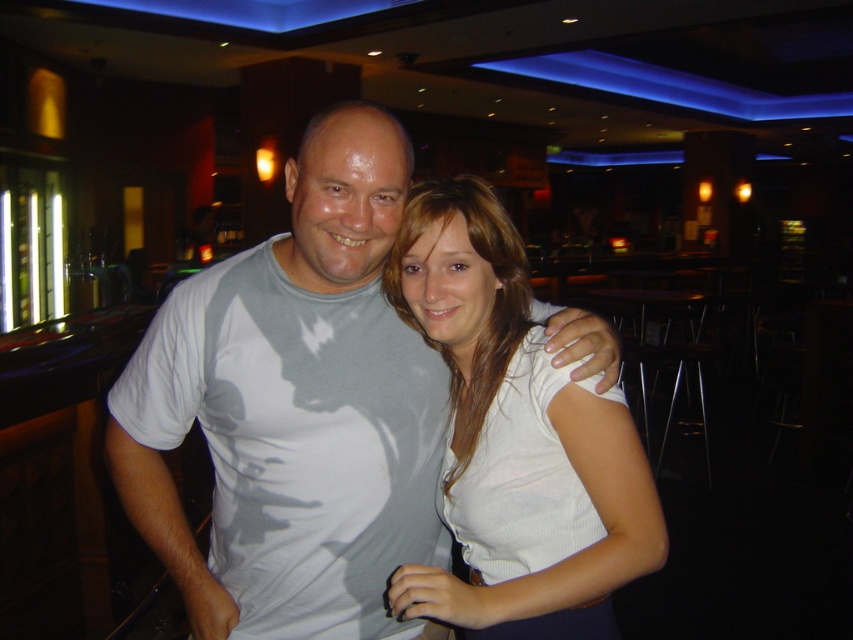
Between white matte t-shirt at center and white ribbed shirt at center, which one appears on the right side from the viewer's perspective?

From the viewer's perspective, white ribbed shirt at center appears more on the right side.

The width and height of the screenshot is (853, 640). Describe the element at coordinates (294, 408) in the screenshot. I see `white matte t-shirt at center` at that location.

Find the location of a particular element. The height and width of the screenshot is (640, 853). white matte t-shirt at center is located at coordinates (x=294, y=408).